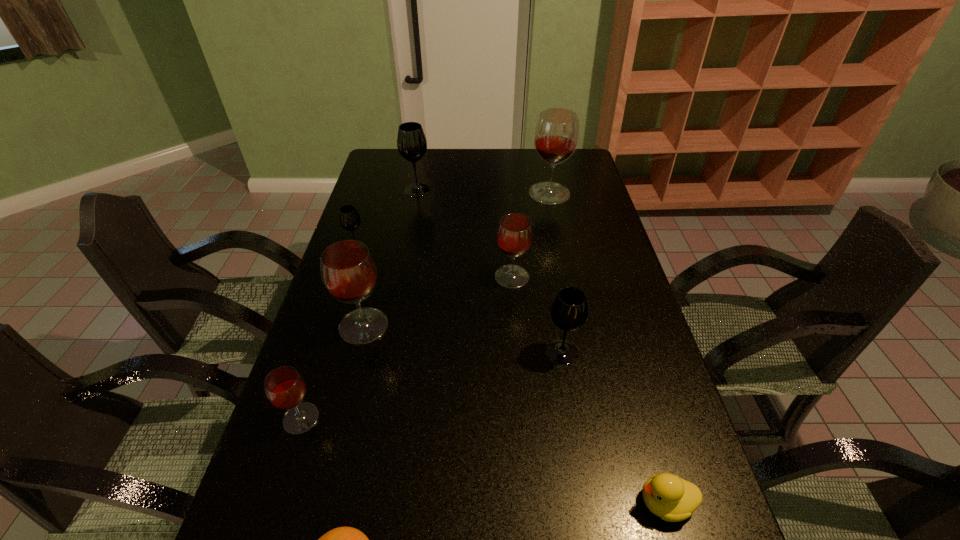
Locate an element on the screen. This screenshot has width=960, height=540. the tallest object is located at coordinates (556, 136).

Locate an element on the screen. the rightmost red wineglass is located at coordinates (556, 136).

Locate an element on the screen. The height and width of the screenshot is (540, 960). the biggest gray wineglass is located at coordinates coord(411,141).

Where is `the second gray wineglass from left to right`? The height and width of the screenshot is (540, 960). the second gray wineglass from left to right is located at coordinates (411, 141).

Where is `the third smallest red wineglass`? The width and height of the screenshot is (960, 540). the third smallest red wineglass is located at coordinates (349, 273).

Image resolution: width=960 pixels, height=540 pixels. I want to click on the third wineglass from right to left, so click(514, 236).

Locate an element on the screen. This screenshot has height=540, width=960. the second farthest red wineglass is located at coordinates (514, 236).

The width and height of the screenshot is (960, 540). In order to click on the rightmost gray wineglass in this screenshot , I will do `click(569, 311)`.

I want to click on the second biggest gray wineglass, so click(x=569, y=311).

The height and width of the screenshot is (540, 960). Identify the location of the third farthest object. (349, 218).